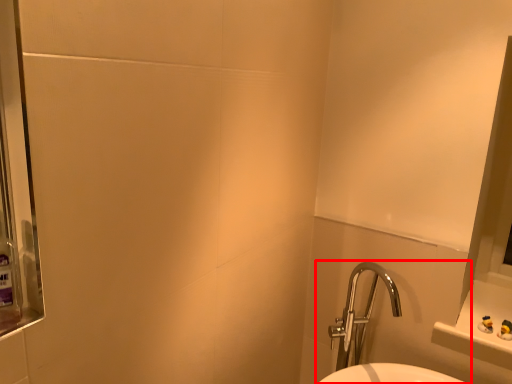
Question: From the image's perspective, where is sink (annotated by the red box) located relative to mouthwash?

Choices:
 (A) below
 (B) above

Answer: (A)